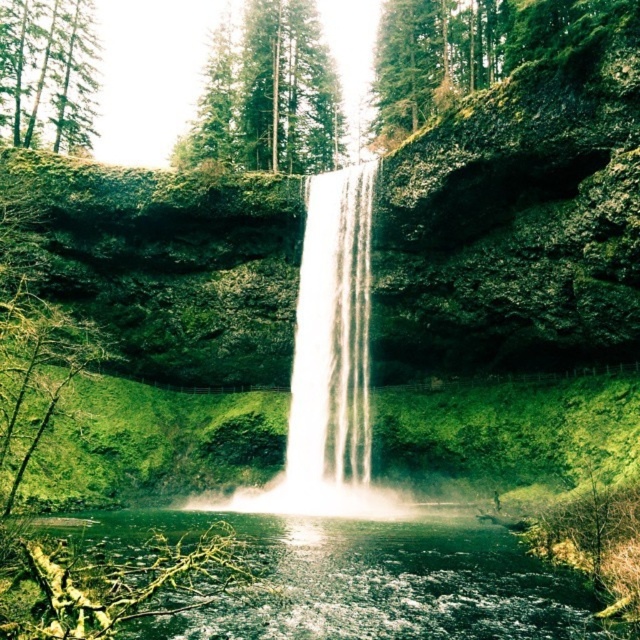
Question: Which point is farther from the camera taking this photo?

Choices:
 (A) (13, 29)
 (B) (330, 272)

Answer: (A)

Question: Among these points, which one is nearest to the camera?

Choices:
 (A) (202, 108)
 (B) (314, 221)

Answer: (B)

Question: Estimate the real-world distances between objects in this image. Which object is closer to the white translucent water at center?

Choices:
 (A) green matte tree at upper left
 (B) green textured tree at upper center

Answer: (B)

Question: Does clear water at center have a greater width compared to green textured tree at upper center?

Choices:
 (A) no
 (B) yes

Answer: (B)

Question: Does white translucent water at center appear under green matte tree at upper left?

Choices:
 (A) no
 (B) yes

Answer: (B)

Question: Is clear water at center further to camera compared to green matte tree at upper left?

Choices:
 (A) no
 (B) yes

Answer: (A)